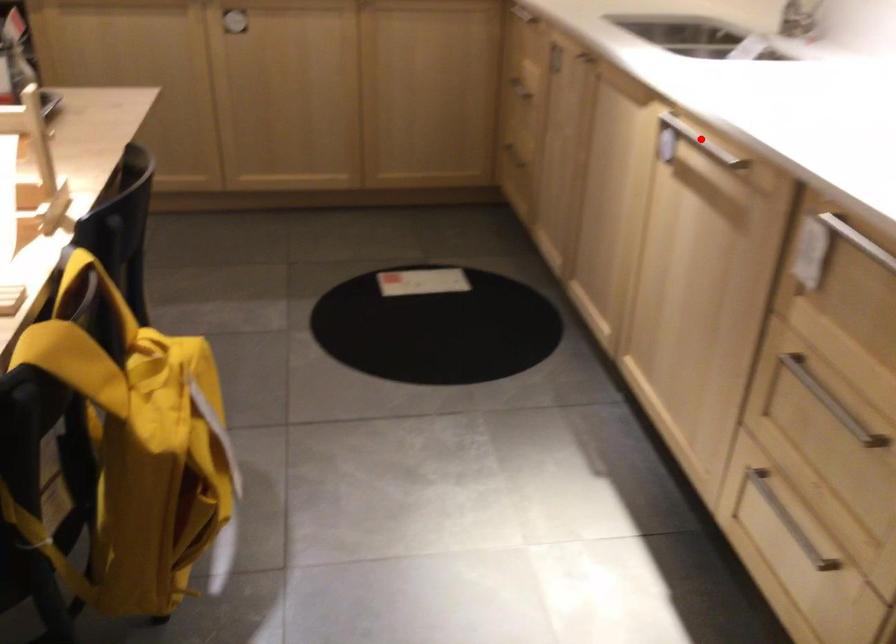
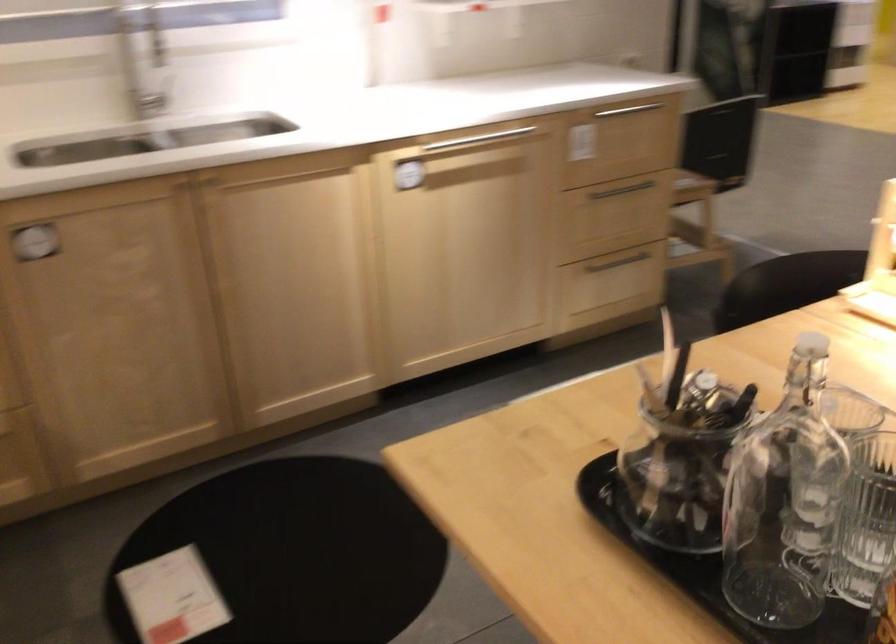
Where in the second image is the point corresponding to the highlighted location from the first image?

(472, 140)